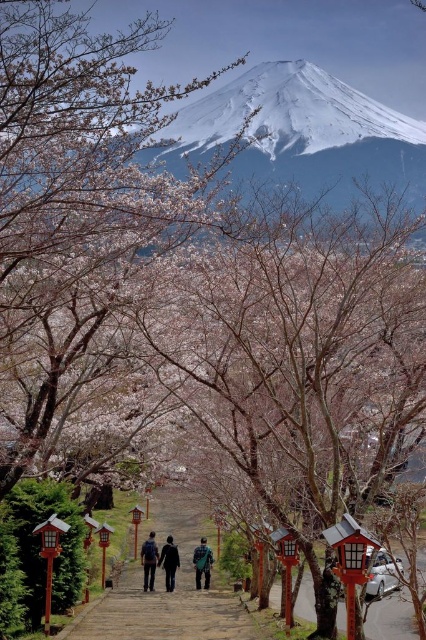
Looking at this image, between cherry blossom branches at center and dark blue jacket at center, which one is positioned lower?

dark blue jacket at center

Between cherry blossom branches at center and dark blue jacket at center, which one appears on the left side from the viewer's perspective?

cherry blossom branches at center

Does point (109, 51) come in front of point (158, 564)?

Yes.

Find the location of a particular element. The width and height of the screenshot is (426, 640). cherry blossom branches at center is located at coordinates (77, 192).

Between point (218, 580) and point (169, 552), which one is positioned in front?

Point (169, 552)

Does brown stone stairs at center have a larger size compared to dark blue jacket at center?

Yes, brown stone stairs at center is bigger than dark blue jacket at center.

Is point (190, 528) closer to camera compared to point (161, 557)?

No, (190, 528) is further to viewer.

Locate an element on the screen. This screenshot has width=426, height=640. brown stone stairs at center is located at coordinates (164, 589).

Is pink blossom tree at center shorter than cherry blossom branches at center?

Correct, pink blossom tree at center is not as tall as cherry blossom branches at center.

Is pink blossom tree at center behind cherry blossom branches at center?

No.

This screenshot has width=426, height=640. What do you see at coordinates (299, 358) in the screenshot?
I see `pink blossom tree at center` at bounding box center [299, 358].

I want to click on pink blossom tree at center, so click(299, 358).